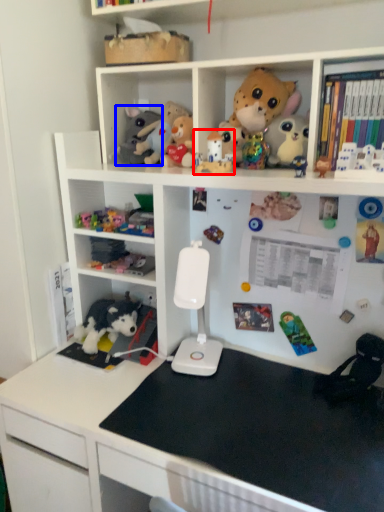
Question: Among these objects, which one is nearest to the camera, toy (highlighted by a red box) or toy (highlighted by a blue box)?

Choices:
 (A) toy
 (B) toy

Answer: (A)